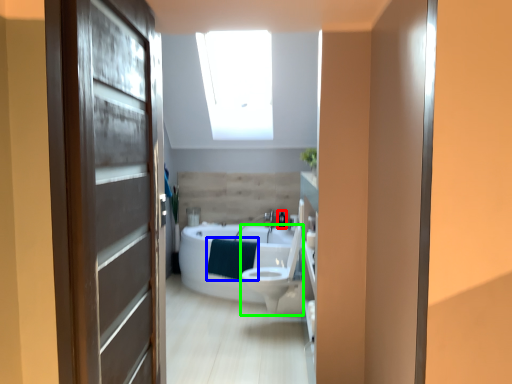
Question: Which is nearer to the toiletry (highlighted by a red box)? blanket (highlighted by a blue box) or toilet bowl (highlighted by a green box).

Choices:
 (A) blanket
 (B) toilet bowl

Answer: (A)